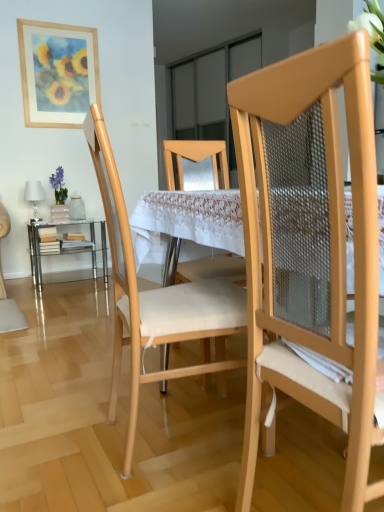
Question: From the image's perspective, is clear glass table at lower left, acting as the second table starting from the front, located above or below natural wood chair at center, placed as the 1th chair when sorted from back to front?

Choices:
 (A) below
 (B) above

Answer: (B)

Question: Is clear glass table at lower left, which is the 1th table from back to front, in front of or behind natural wood chair at center, marked as the second chair in a front-to-back arrangement, in the image?

Choices:
 (A) behind
 (B) front

Answer: (A)

Question: Considering the real-world distances, which object is closest to the natural wood chair at center, placed as the 1th chair when sorted from back to front?

Choices:
 (A) clear glass table at lower left, which is the 1th table from back to front
 (B) matte wood chair at right, which appears as the first chair when viewed from the front
 (C) white lace tablecloth at center, which is counted as the first table, starting from the right
 (D) wooden framed artwork at upper left

Answer: (C)

Question: Estimate the real-world distances between objects in this image. Which object is farther from the natural wood chair at center, placed as the 1th chair when sorted from back to front?

Choices:
 (A) white lace tablecloth at center, the second table when ordered from left to right
 (B) clear glass table at lower left, the 2th table positioned from the right
 (C) matte wood chair at right, the second chair when ordered from back to front
 (D) wooden framed artwork at upper left

Answer: (D)